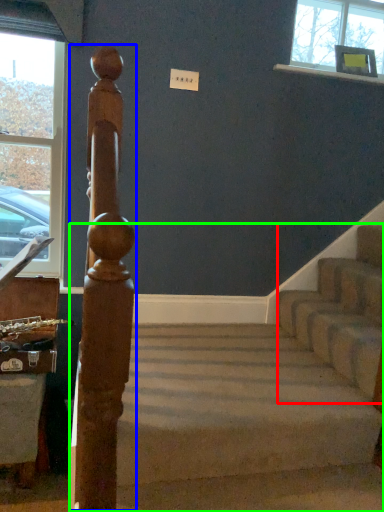
Question: Which object is the closest to the stairwell (highlighted by a red box)? Choose among these: beam (highlighted by a blue box) or stairs (highlighted by a green box).

Choices:
 (A) beam
 (B) stairs

Answer: (B)